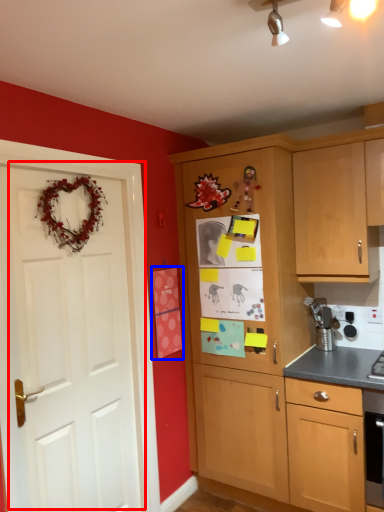
Question: Which point is further to the camera, door (highlighted by a red box) or postcard (highlighted by a blue box)?

Choices:
 (A) door
 (B) postcard

Answer: (B)